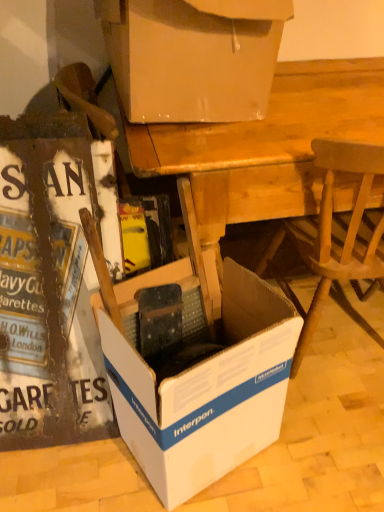
Question: Does white cardboard box at lower left, the 2th box ordered from the bottom, lie in front of wooden desk at center?

Choices:
 (A) yes
 (B) no

Answer: (A)

Question: Is white cardboard box at lower left, the second box from the top, beside wooden desk at center?

Choices:
 (A) no
 (B) yes

Answer: (A)

Question: Is wooden desk at center at the back of white cardboard box at lower left, the 2th box ordered from the bottom?

Choices:
 (A) yes
 (B) no

Answer: (B)

Question: Is white cardboard box at lower left, the 2th box ordered from the bottom, to the left of wooden desk at center from the viewer's perspective?

Choices:
 (A) yes
 (B) no

Answer: (A)

Question: Can you confirm if white cardboard box at lower left, the 2th box ordered from the bottom, is thinner than wooden desk at center?

Choices:
 (A) yes
 (B) no

Answer: (A)

Question: From a real-world perspective, is white cardboard box at upper center, which is the first box from top to bottom, positioned above or below wooden chair at lower right?

Choices:
 (A) below
 (B) above

Answer: (B)

Question: Considering their positions, is white cardboard box at upper center, placed as the 3th box when sorted from bottom to top, located in front of or behind wooden chair at lower right?

Choices:
 (A) front
 (B) behind

Answer: (B)

Question: Based on their sizes in the image, would you say white cardboard box at upper center, placed as the 3th box when sorted from bottom to top, is bigger or smaller than wooden chair at lower right?

Choices:
 (A) big
 (B) small

Answer: (B)

Question: Is white cardboard box at upper center, placed as the 3th box when sorted from bottom to top, taller or shorter than wooden chair at lower right?

Choices:
 (A) short
 (B) tall

Answer: (A)

Question: Is white cardboard box at upper center, placed as the 3th box when sorted from bottom to top, inside the boundaries of wooden desk at center, or outside?

Choices:
 (A) inside
 (B) outside

Answer: (B)

Question: Would you say white cardboard box at upper center, which is the first box from top to bottom, is to the left or to the right of wooden desk at center in the picture?

Choices:
 (A) left
 (B) right

Answer: (A)

Question: From a real-world perspective, is white cardboard box at upper center, placed as the 3th box when sorted from bottom to top, physically located above or below wooden desk at center?

Choices:
 (A) below
 (B) above

Answer: (B)

Question: From the image's perspective, is white cardboard box at upper center, which is the first box from top to bottom, positioned above or below wooden desk at center?

Choices:
 (A) below
 (B) above

Answer: (B)

Question: Would you say white cardboard box at lower left, the second box from the top, is inside or outside wooden desk at center?

Choices:
 (A) inside
 (B) outside

Answer: (B)

Question: From the image's perspective, relative to wooden desk at center, is white cardboard box at lower left, the 2th box ordered from the bottom, above or below?

Choices:
 (A) above
 (B) below

Answer: (B)